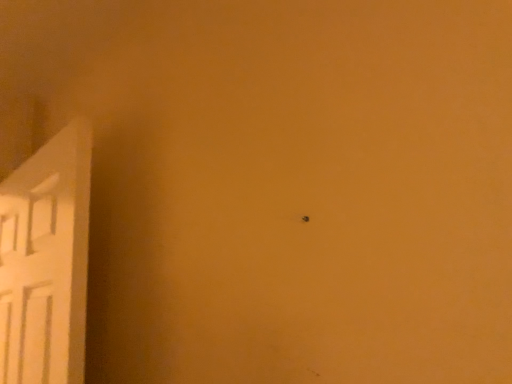
Identify the location of white matte door at left. The height and width of the screenshot is (384, 512). (46, 262).

Describe the element at coordinates (46, 262) in the screenshot. This screenshot has height=384, width=512. I see `white matte door at left` at that location.

This screenshot has width=512, height=384. Find the location of `white matte door at left`. white matte door at left is located at coordinates (46, 262).